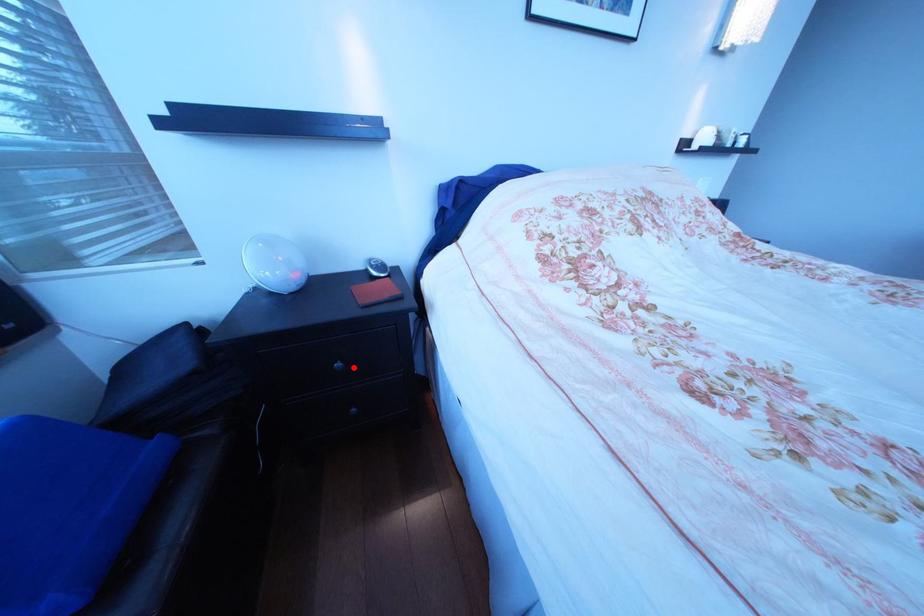
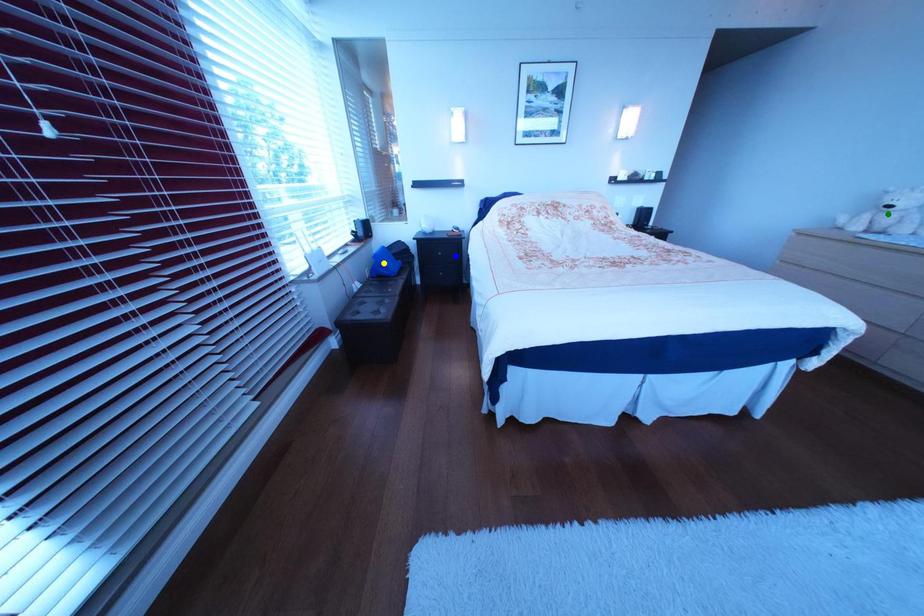
Question: I am providing you with two images of the same scene from different viewpoints. A red point is marked on the first image. You are given multiple points on the second image. Which mark in image 2 goes with the point in image 1?

Choices:
 (A) blue point
 (B) green point
 (C) yellow point

Answer: (A)